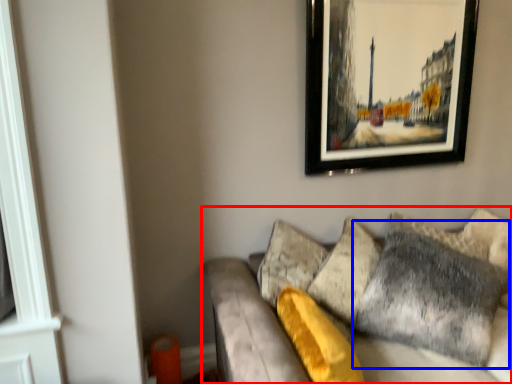
Question: Which point is further to the camera, studio couch (highlighted by a red box) or pillow (highlighted by a blue box)?

Choices:
 (A) studio couch
 (B) pillow

Answer: (B)